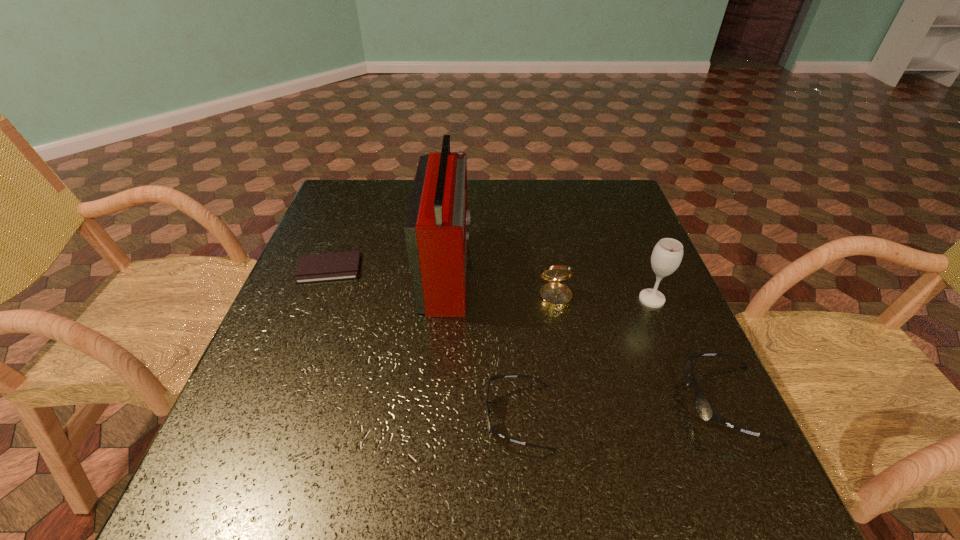
What are the coordinates of `vacant spot to place a sunglasses on the left` in the screenshot? It's located at (300, 431).